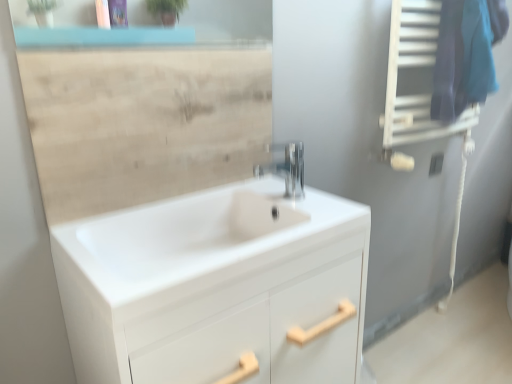
Question: From the image's perspective, is polished chrome faucet at center located beneath white glossy cabinet at center?

Choices:
 (A) no
 (B) yes

Answer: (A)

Question: From a real-world perspective, is polished chrome faucet at center positioned over white glossy cabinet at center based on gravity?

Choices:
 (A) yes
 (B) no

Answer: (A)

Question: Does polished chrome faucet at center have a lesser width compared to white glossy cabinet at center?

Choices:
 (A) no
 (B) yes

Answer: (B)

Question: Is polished chrome faucet at center not inside white glossy cabinet at center?

Choices:
 (A) yes
 (B) no

Answer: (A)

Question: From the image's perspective, is polished chrome faucet at center on white glossy cabinet at center?

Choices:
 (A) no
 (B) yes

Answer: (B)

Question: Is polished chrome faucet at center looking in the opposite direction of white glossy cabinet at center?

Choices:
 (A) no
 (B) yes

Answer: (A)

Question: Could you tell me if beige wood mirror at upper center is facing blue fabric at upper right?

Choices:
 (A) no
 (B) yes

Answer: (A)

Question: Is blue fabric at upper right inside beige wood mirror at upper center?

Choices:
 (A) no
 (B) yes

Answer: (A)

Question: Can you confirm if beige wood mirror at upper center is shorter than blue fabric at upper right?

Choices:
 (A) no
 (B) yes

Answer: (B)

Question: From the image's perspective, is beige wood mirror at upper center on top of blue fabric at upper right?

Choices:
 (A) yes
 (B) no

Answer: (B)

Question: Is beige wood mirror at upper center next to blue fabric at upper right?

Choices:
 (A) yes
 (B) no

Answer: (B)

Question: Is blue fabric at upper right at the back of beige wood mirror at upper center?

Choices:
 (A) yes
 (B) no

Answer: (B)

Question: From a real-world perspective, is beige wood mirror at upper center located beneath polished chrome faucet at center?

Choices:
 (A) no
 (B) yes

Answer: (A)